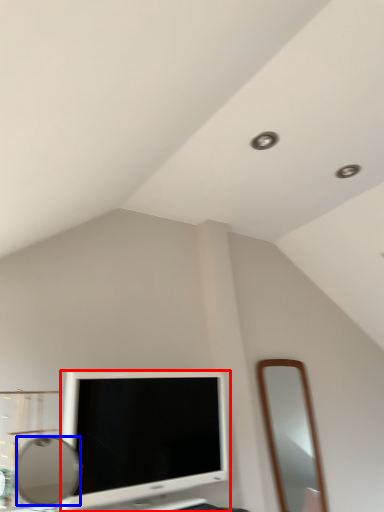
Question: Which of the following is the farthest to the observer, television (highlighted by a red box) or mirror (highlighted by a blue box)?

Choices:
 (A) television
 (B) mirror

Answer: (A)